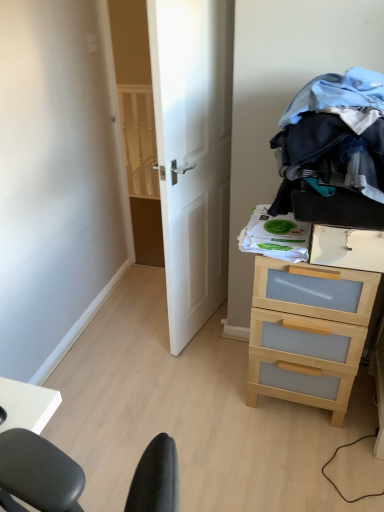
Where is `vacant space in white wooden door at center (from a real-world perspective)`? vacant space in white wooden door at center (from a real-world perspective) is located at coordinates (206, 326).